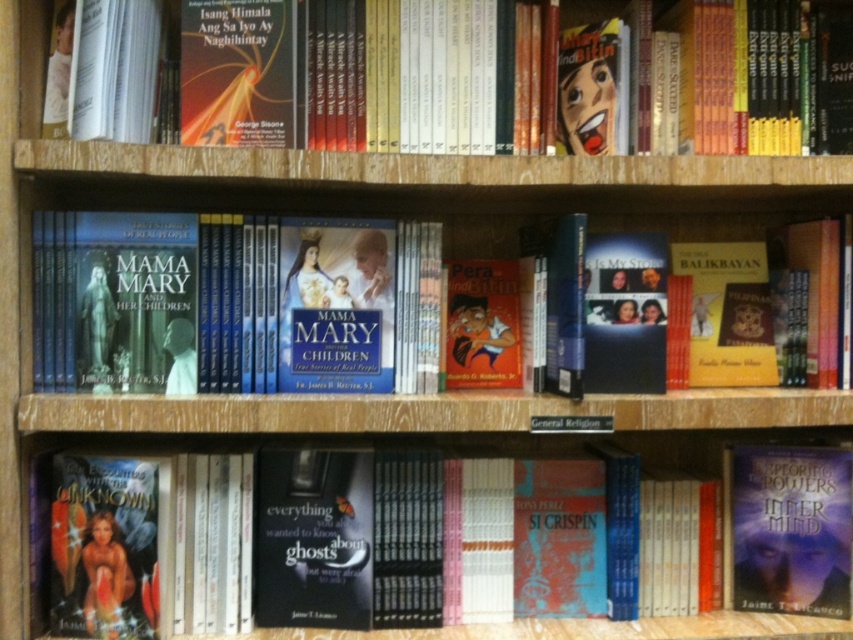
Question: Is the position of matte hardcover book at center less distant than that of matte orange book at center?

Choices:
 (A) yes
 (B) no

Answer: (A)

Question: Can you confirm if hardcover book at center is positioned to the right of matte hardcover book at center?

Choices:
 (A) yes
 (B) no

Answer: (A)

Question: Which point appears farthest from the camera in this image?

Choices:
 (A) (502, 340)
 (B) (416, 131)

Answer: (A)

Question: Which object is positioned farthest from the hardcover book at lower left?

Choices:
 (A) matte hardcover book at center
 (B) matte orange book at center

Answer: (A)

Question: Which point appears closest to the camera in this image?

Choices:
 (A) (793, 144)
 (B) (347, 387)
 (C) (782, 529)
 (D) (480, 337)

Answer: (B)

Question: Is hardcover book at center to the left of hardcover book at lower left from the viewer's perspective?

Choices:
 (A) no
 (B) yes

Answer: (B)